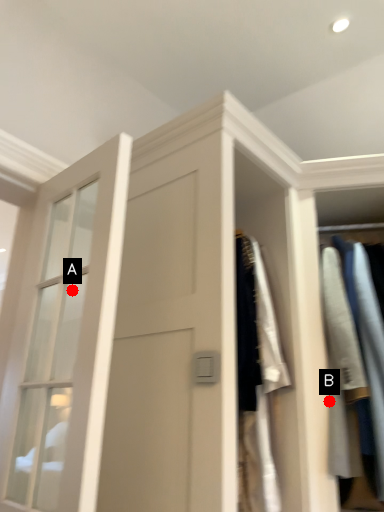
Question: Two points are circled on the image, labeled by A and B beside each circle. Which point is further to the camera?

Choices:
 (A) A is further
 (B) B is further

Answer: (A)